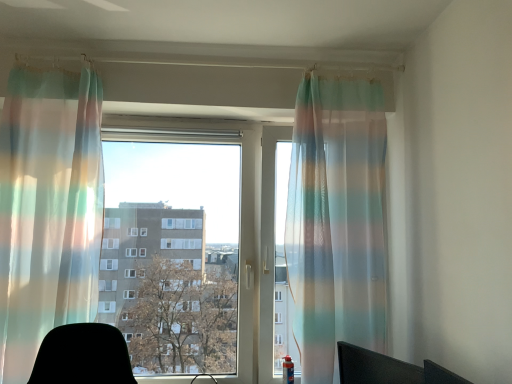
Question: From a real-world perspective, is translucent rainbow striped curtain at left, the 2th curtain viewed from the right, physically located above or below transparent fabric at center?

Choices:
 (A) above
 (B) below

Answer: (A)

Question: Which is correct: translucent rainbow striped curtain at left, which is the 1th curtain from left to right, is inside transparent fabric at center, or outside of it?

Choices:
 (A) outside
 (B) inside

Answer: (A)

Question: Which of these objects is positioned farthest from the translucent striped curtain at center, which appears as the 1th curtain when viewed from the right?

Choices:
 (A) translucent rainbow striped curtain at left, which is the 1th curtain from left to right
 (B) transparent fabric at center
 (C) black matte computer chair at lower right

Answer: (A)

Question: Estimate the real-world distances between objects in this image. Which object is farther from the black matte computer chair at lower right?

Choices:
 (A) translucent rainbow striped curtain at left, which is the 1th curtain from left to right
 (B) translucent striped curtain at center, which appears as the 1th curtain when viewed from the right
 (C) transparent fabric at center

Answer: (A)